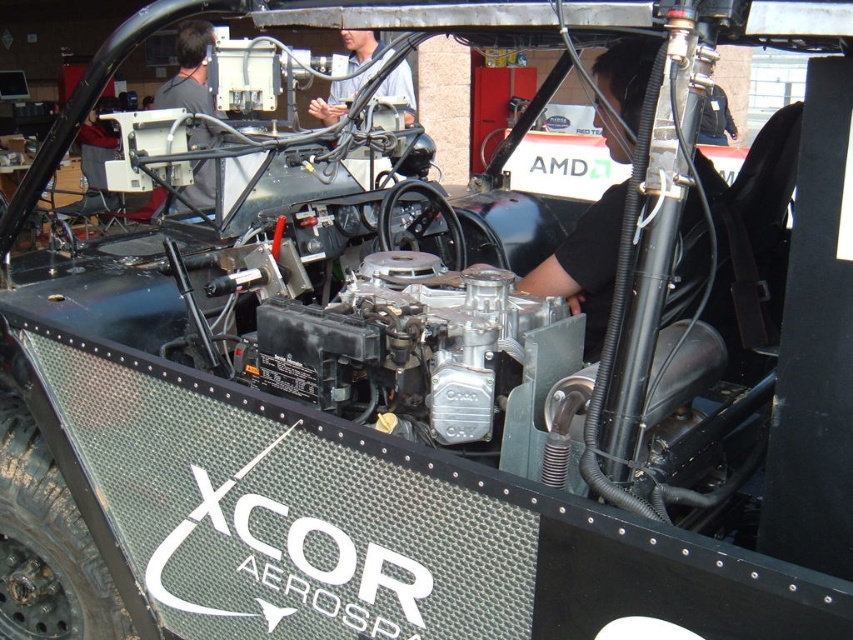
Is black matte shirt at center bigger than black matte computer at upper left?

Yes.

Locate an element on the screen. The image size is (853, 640). black matte shirt at center is located at coordinates (585, 266).

This screenshot has width=853, height=640. What do you see at coordinates (585, 266) in the screenshot? I see `black matte shirt at center` at bounding box center [585, 266].

You are a GUI agent. You are given a task and a screenshot of the screen. Output one action in this format:
    pyautogui.click(x=<x>, y=<y>)
    Task: Click on the black matte shirt at center
    This screenshot has width=853, height=640.
    Given the screenshot: What is the action you would take?
    pyautogui.click(x=585, y=266)

Is black matte computer at upper left positioned behind light blue shirt at upper center?

That is True.

Does black matte computer at upper left appear on the left side of light blue shirt at upper center?

Indeed, black matte computer at upper left is positioned on the left side of light blue shirt at upper center.

Is point (167, 99) positioned in front of point (409, 106)?

No, (167, 99) is further to viewer.

Where is `black matte computer at upper left`? The image size is (853, 640). black matte computer at upper left is located at coordinates (189, 72).

Who is taller, black matte shirt at center or light blue shirt at upper center?

With more height is light blue shirt at upper center.

Between point (614, 211) and point (405, 61), which one is positioned in front?

Point (614, 211)

At what (x,y) coordinates should I click in order to perform the action: click on black matte shirt at center. Please return your answer as a coordinate pair (x, y). This screenshot has height=640, width=853. Looking at the image, I should click on (585, 266).